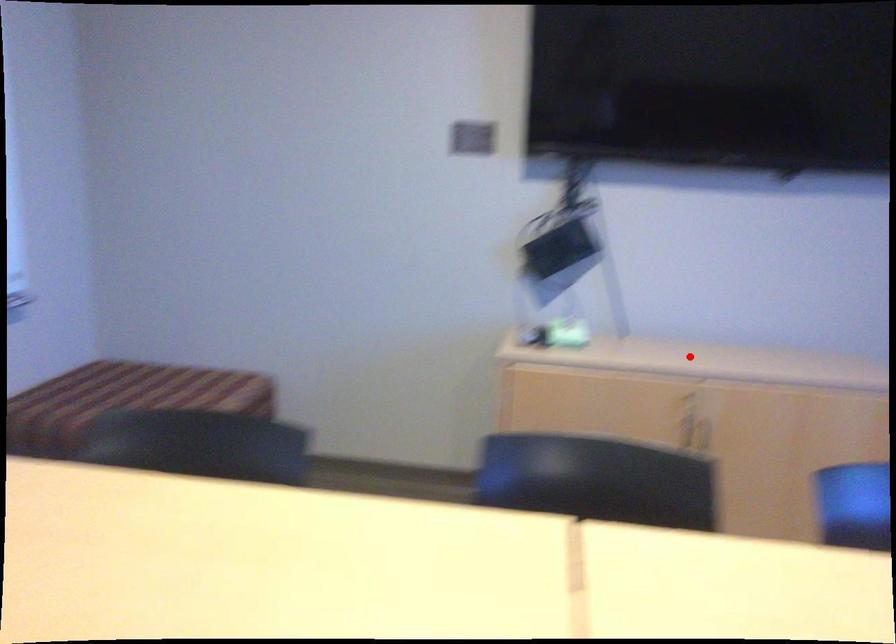
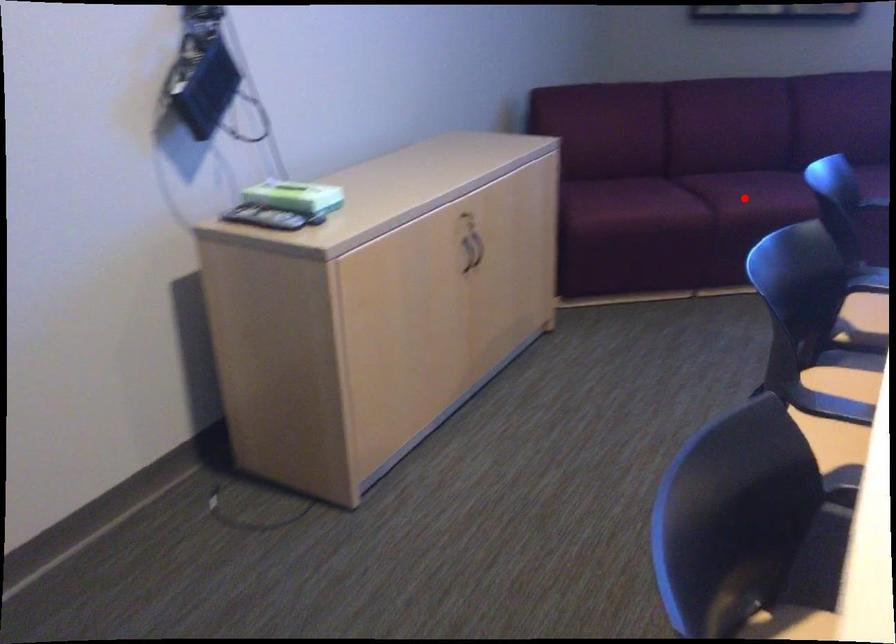
I am providing you with two images of the same scene from different viewpoints. A red point is marked on the first image and another point is marked on the second image. Does the point marked in image1 correspond to the same location as the one in image2?

No